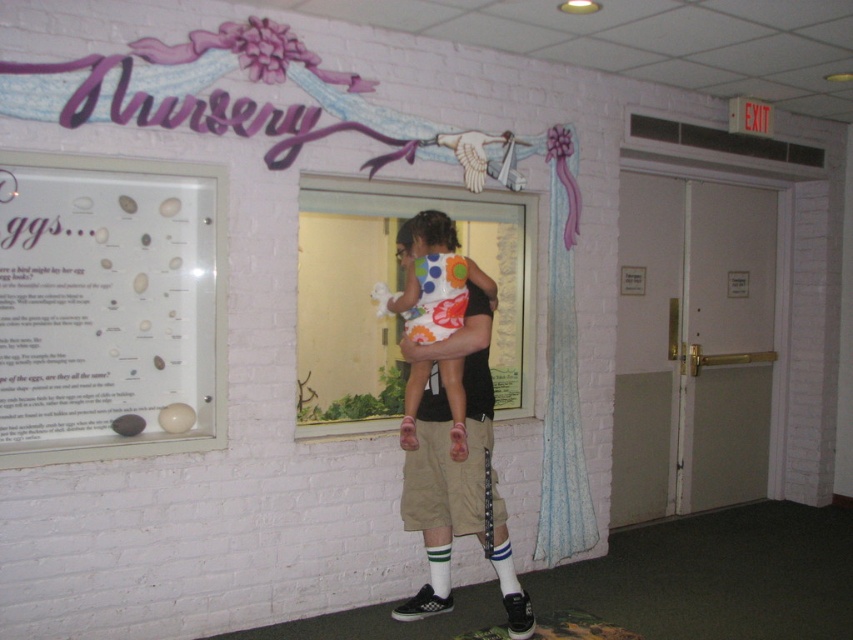
Is matte glass display case at left smaller than polka dot fabric dress at center?

Incorrect, matte glass display case at left is not smaller in size than polka dot fabric dress at center.

Between matte glass display case at left and polka dot fabric dress at center, which one is positioned higher?

matte glass display case at left

Is point (131, 353) positioned behind point (440, 275)?

No, it is not.

Find the location of `matte glass display case at left`. matte glass display case at left is located at coordinates tap(109, 307).

Does matte glass display case at left have a smaller size compared to khaki shorts at center?

Yes.

What do you see at coordinates (109, 307) in the screenshot? I see `matte glass display case at left` at bounding box center [109, 307].

Is point (167, 250) positioned before point (502, 502)?

Yes, point (167, 250) is in front of point (502, 502).

At what (x,y) coordinates should I click in order to perform the action: click on matte glass display case at left. Please return your answer as a coordinate pair (x, y). Looking at the image, I should click on tap(109, 307).

Which is in front, point (425, 600) or point (491, 296)?

Point (491, 296) is more forward.

Image resolution: width=853 pixels, height=640 pixels. What do you see at coordinates (448, 444) in the screenshot? I see `khaki shorts at center` at bounding box center [448, 444].

Which is behind, point (466, 428) or point (450, 257)?

Point (450, 257)

Where is `khaki shorts at center`? The width and height of the screenshot is (853, 640). khaki shorts at center is located at coordinates (448, 444).